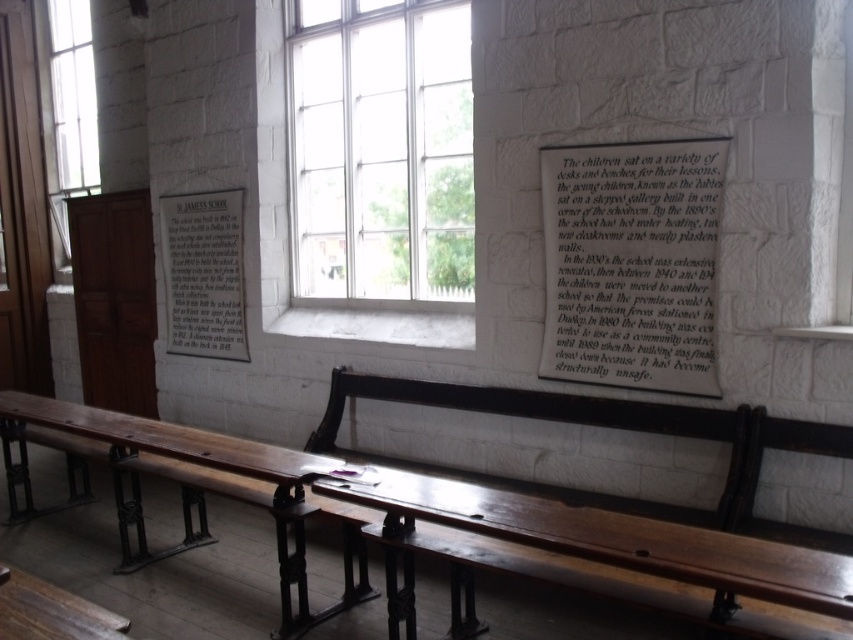
From the picture: Is white paper plaque at center smaller than clear glass window at upper left?

Indeed, white paper plaque at center has a smaller size compared to clear glass window at upper left.

Looking at this image, between white paper plaque at center and clear glass window at upper left, which one appears on the right side from the viewer's perspective?

From the viewer's perspective, white paper plaque at center appears more on the right side.

Describe the element at coordinates (204, 273) in the screenshot. I see `white paper plaque at center` at that location.

This screenshot has width=853, height=640. I want to click on white paper plaque at center, so click(204, 273).

Is white paper at upper center positioned before wooden polished bench at center?

No, it is behind wooden polished bench at center.

Does white paper at upper center appear over wooden polished bench at center?

Yes.

Locate an element on the screen. The image size is (853, 640). white paper at upper center is located at coordinates (631, 262).

In the scene shown: Is white paper at upper center shorter than clear glass window at upper left?

Indeed, white paper at upper center has a lesser height compared to clear glass window at upper left.

Does white paper at upper center appear over clear glass window at upper left?

No, white paper at upper center is not above clear glass window at upper left.

Is point (619, 291) less distant than point (85, 3)?

Yes, it is.

Image resolution: width=853 pixels, height=640 pixels. I want to click on white paper at upper center, so click(x=631, y=262).